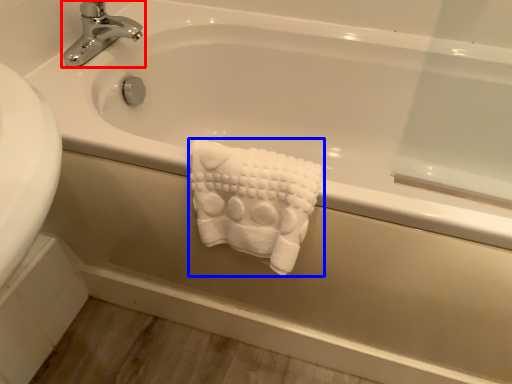
Question: Which point is further to the camera, tap (highlighted by a red box) or towel (highlighted by a blue box)?

Choices:
 (A) tap
 (B) towel

Answer: (A)